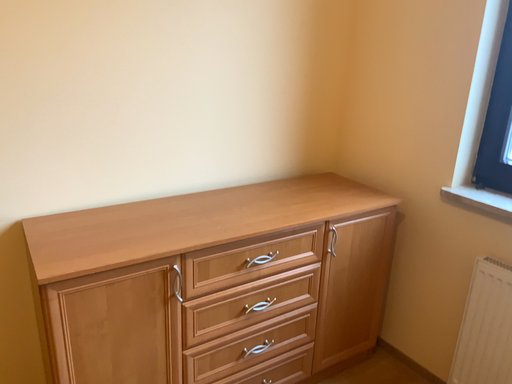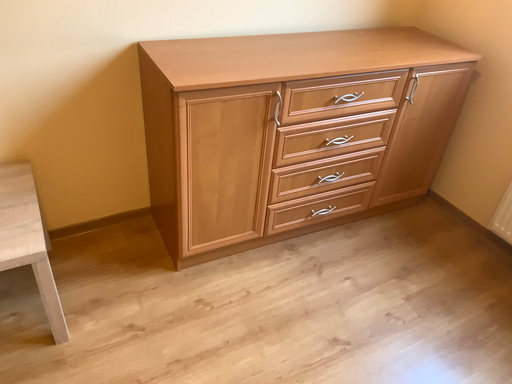
Question: Which way did the camera rotate in the video?

Choices:
 (A) rotated downward
 (B) rotated upward

Answer: (A)